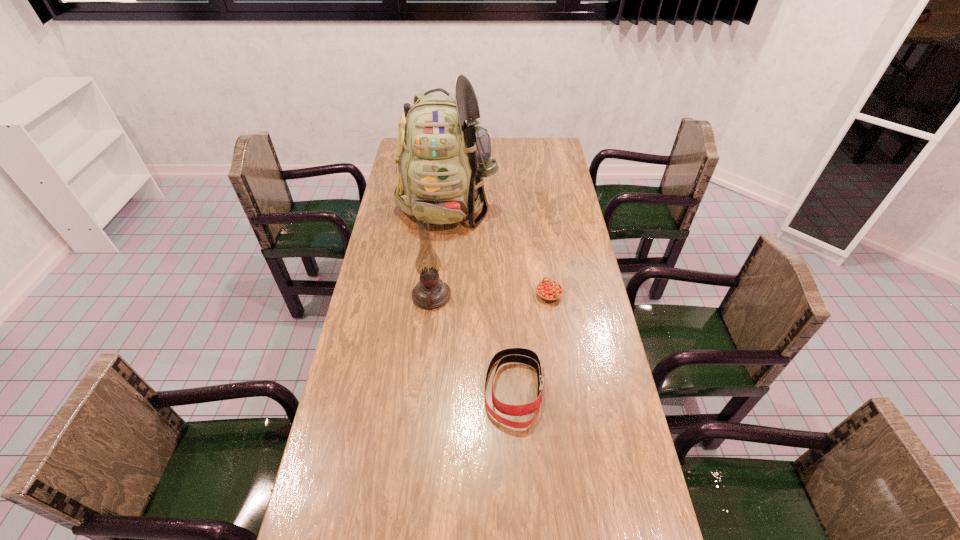
Image resolution: width=960 pixels, height=540 pixels. In order to click on backpack in this screenshot , I will do `click(442, 156)`.

Find the location of a particular element. the tallest object is located at coordinates (442, 156).

Find the location of a particular element. This screenshot has height=540, width=960. oil lamp is located at coordinates (431, 292).

The height and width of the screenshot is (540, 960). Identify the location of dog collar. (520, 355).

Image resolution: width=960 pixels, height=540 pixels. Find the location of `the rightmost object`. the rightmost object is located at coordinates (548, 290).

At what (x,y) coordinates should I click in order to perform the action: click on blank area located on the front-facing side of the farthest object. Please return your answer as a coordinate pair (x, y). Looking at the image, I should click on (443, 262).

At what (x,y) coordinates should I click in order to perform the action: click on blank area located on the left of the oil lamp. Please return your answer as a coordinate pair (x, y). Image resolution: width=960 pixels, height=540 pixels. Looking at the image, I should click on (365, 296).

I want to click on free space located 0.210m on the left of the nearest object, so click(410, 390).

Identify the location of vacant region located 0.120m on the front of the strawberry. The width and height of the screenshot is (960, 540). (555, 334).

Where is `object at the left edge`? object at the left edge is located at coordinates (442, 156).